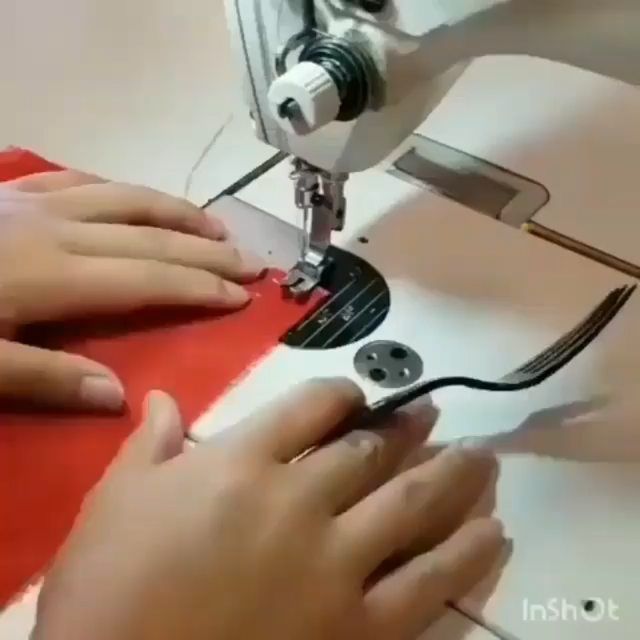
The width and height of the screenshot is (640, 640). Identify the location of empty space - counter top. (176, 63).